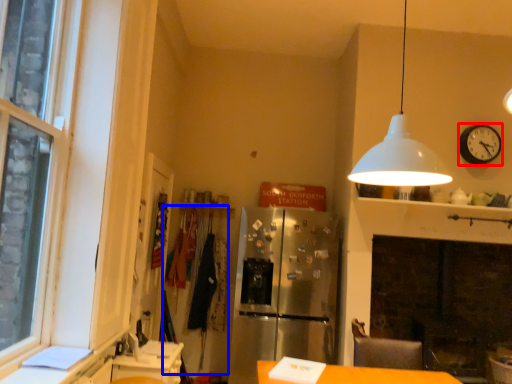
Question: Which of the following is the farthest to the observer, clock (highlighted by a red box) or laundry (highlighted by a blue box)?

Choices:
 (A) clock
 (B) laundry

Answer: (B)